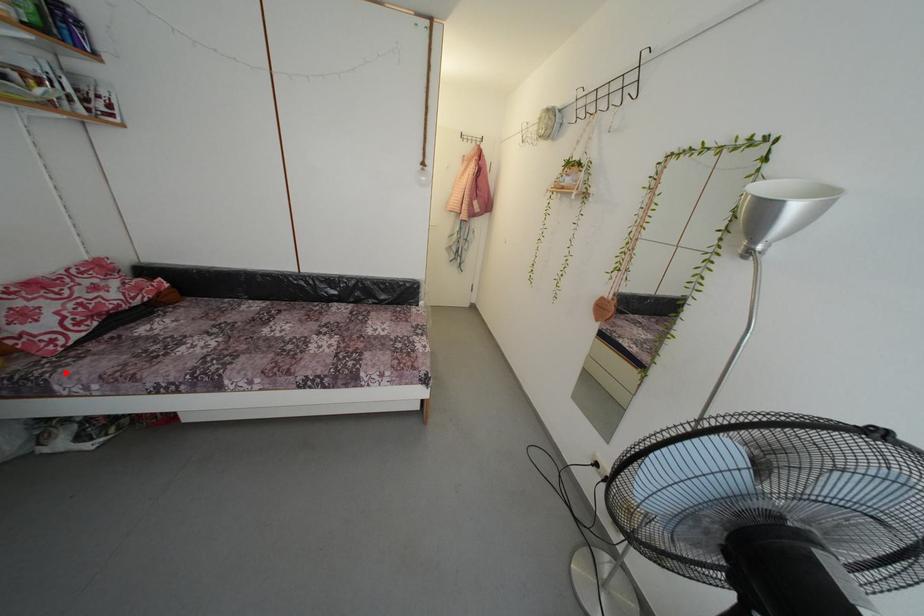
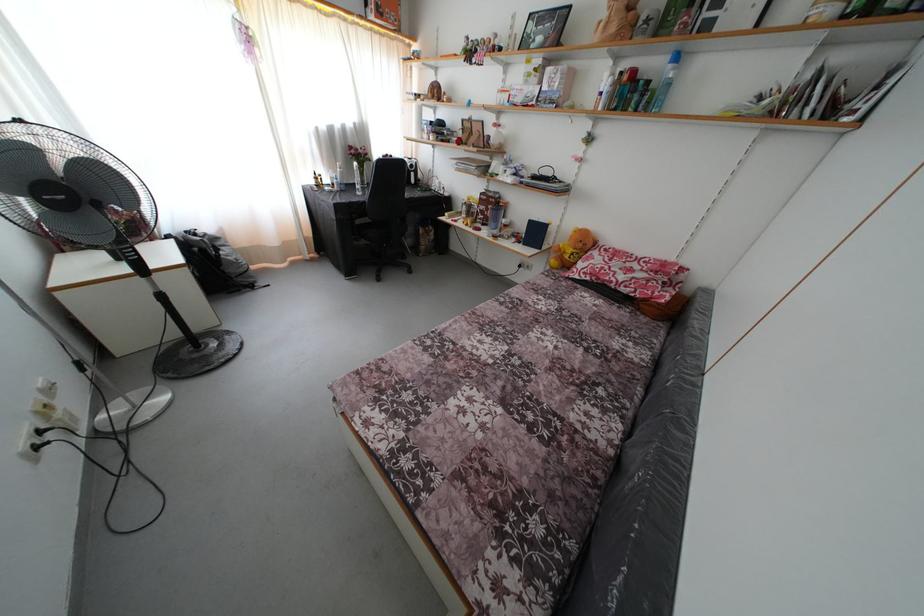
Question: I am providing you with two images of the same scene from different viewpoints. In image1, a red point is highlighted. Considering the same 3D point in image2, which of the following is correct?

Choices:
 (A) It is closer
 (B) It is farther

Answer: (A)